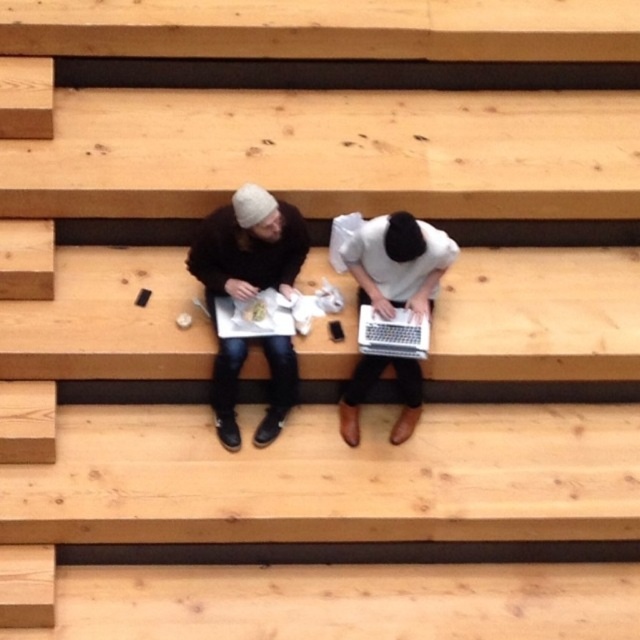
In the scene shown: What is located at the coordinates point (248, 248)?

The point (248, 248) is occupied by a matte black jacket at center.

You are sitting on the wooden bleachers and want to place your silver metallic laptop at center on top of the matte black jacket at center. Is this possible based on their sizes?

The matte black jacket at center is taller than the silver metallic laptop at center, so placing the silver metallic laptop at center on top of the matte black jacket at center is possible as the jacket provides enough vertical space.

You are sitting at the center of the bleachers and have two laptops in front of you, a white matte laptop at center and a silver metallic laptop at center. Which one would you need to reach further to pick up?

The silver metallic laptop at center is further away from you than the white matte laptop at center, so you would need to reach further to pick up the silver metallic laptop at center.